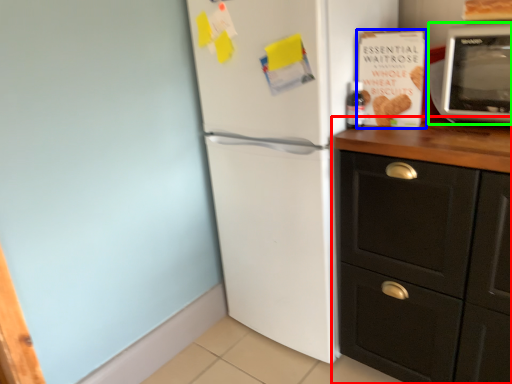
Question: Which is farther away from cabinetry (highlighted by a red box)? magazine (highlighted by a blue box) or microwave oven (highlighted by a green box)?

Choices:
 (A) magazine
 (B) microwave oven

Answer: (B)